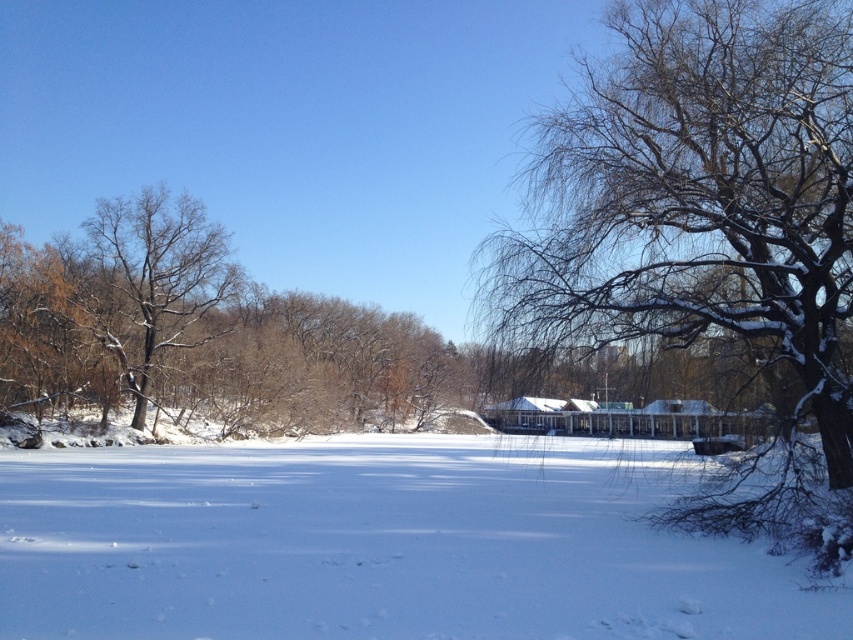
Question: Estimate the real-world distances between objects in this image. Which object is closer to the white powdery snow at center?

Choices:
 (A) brown/dry wood tree at left
 (B) snow-covered branches at center

Answer: (B)

Question: Considering the real-world distances, which object is closest to the snow-covered branches at center?

Choices:
 (A) brown/dry wood tree at left
 (B) white powdery snow at center

Answer: (B)

Question: Does white powdery snow at center appear under snow-covered branches at center?

Choices:
 (A) no
 (B) yes

Answer: (B)

Question: Does white powdery snow at center appear on the right side of brown/dry wood tree at left?

Choices:
 (A) yes
 (B) no

Answer: (A)

Question: Estimate the real-world distances between objects in this image. Which object is closer to the brown/dry wood tree at left?

Choices:
 (A) white powdery snow at center
 (B) snow-covered branches at center

Answer: (A)

Question: Does white powdery snow at center appear under snow-covered branches at center?

Choices:
 (A) yes
 (B) no

Answer: (A)